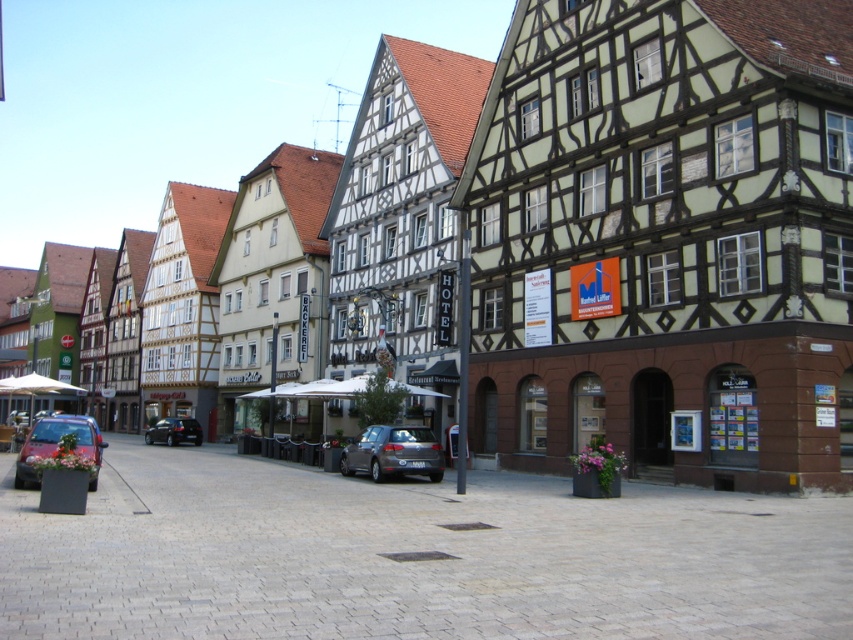
Does satin silver metallic car at center have a smaller size compared to matte red car at lower left?

Yes, satin silver metallic car at center is smaller than matte red car at lower left.

Can you confirm if satin silver metallic car at center is taller than matte red car at lower left?

In fact, satin silver metallic car at center may be shorter than matte red car at lower left.

In order to click on satin silver metallic car at center in this screenshot , I will do tap(393, 452).

The image size is (853, 640). Find the location of `satin silver metallic car at center`. satin silver metallic car at center is located at coordinates (393, 452).

Between satin silver metallic car at center and shiny black sedan at center, which one has more height?

With more height is satin silver metallic car at center.

Can you confirm if satin silver metallic car at center is thinner than shiny black sedan at center?

Yes.

Does point (440, 476) come farther from viewer compared to point (144, 442)?

No, it is not.

This screenshot has width=853, height=640. I want to click on satin silver metallic car at center, so click(x=393, y=452).

Does matte red car at lower left have a smaller size compared to shiny black sedan at center?

Incorrect, matte red car at lower left is not smaller in size than shiny black sedan at center.

From the picture: Who is lower down, matte red car at lower left or shiny black sedan at center?

shiny black sedan at center

Locate an element on the screen. The image size is (853, 640). matte red car at lower left is located at coordinates pyautogui.click(x=56, y=444).